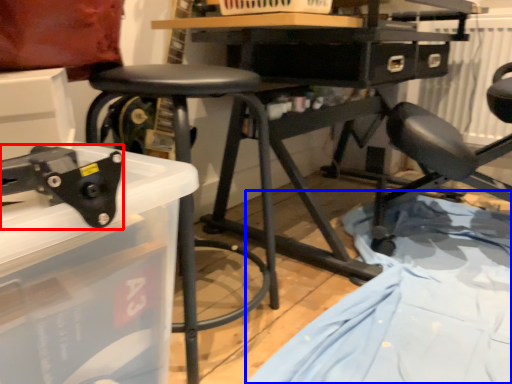
Question: Which object is further to the camera taking this photo, tool (highlighted by a red box) or sheet (highlighted by a blue box)?

Choices:
 (A) tool
 (B) sheet

Answer: (B)